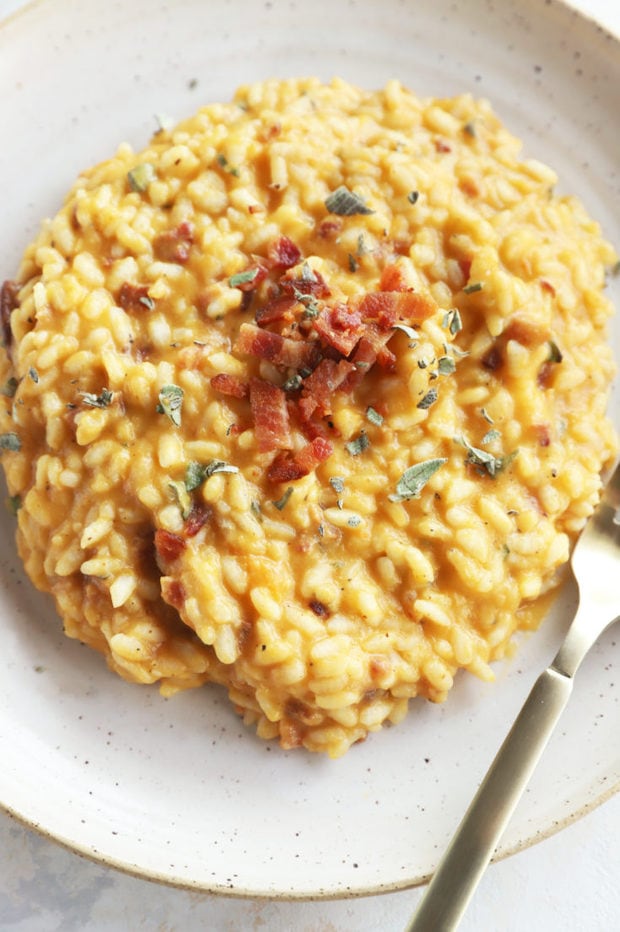
What are the coordinates of `fork` in the screenshot? It's located at (527, 739).